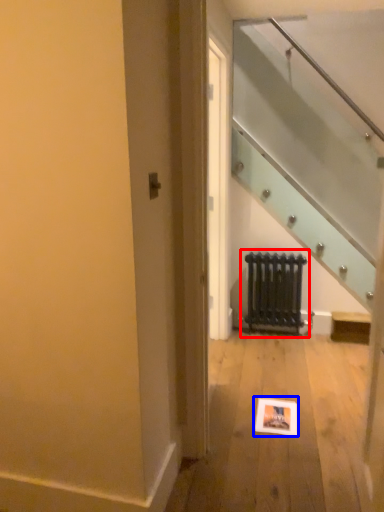
Question: Which of the following is the closest to the observer, radiator (highlighted by a red box) or picture frame (highlighted by a blue box)?

Choices:
 (A) radiator
 (B) picture frame

Answer: (B)